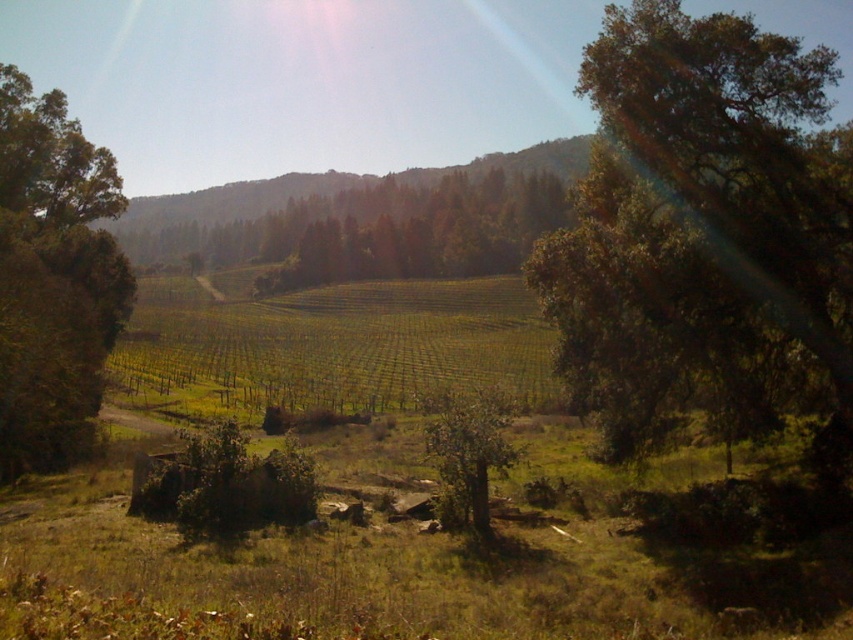
Does green leafy tree at upper right appear on the right side of green grassy field at center?

Yes, green leafy tree at upper right is to the right of green grassy field at center.

Does green leafy tree at upper right come in front of green grassy field at center?

Yes, green leafy tree at upper right is in front of green grassy field at center.

The image size is (853, 640). In order to click on green leafy tree at upper right in this screenshot , I will do `click(701, 230)`.

Which of these two, green grassy field at center or green leafy tree at left, stands shorter?

Standing shorter between the two is green grassy field at center.

Can you confirm if green grassy field at center is smaller than green leafy tree at left?

Incorrect, green grassy field at center is not smaller in size than green leafy tree at left.

Who is more distant from viewer, (341, 396) or (38, 349)?

Point (341, 396)

The width and height of the screenshot is (853, 640). Find the location of `green grassy field at center`. green grassy field at center is located at coordinates (345, 342).

Consider the image. Does green matte tree at center have a greater width compared to green leafy tree at center?

Correct, the width of green matte tree at center exceeds that of green leafy tree at center.

Does green matte tree at center appear on the right side of green leafy tree at center?

Incorrect, green matte tree at center is not on the right side of green leafy tree at center.

The width and height of the screenshot is (853, 640). What do you see at coordinates (418, 232) in the screenshot? I see `green matte tree at center` at bounding box center [418, 232].

The image size is (853, 640). Identify the location of green matte tree at center. (418, 232).